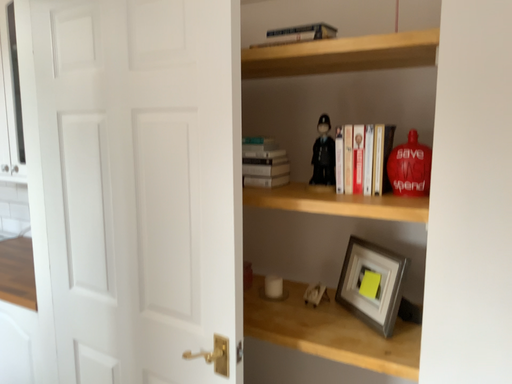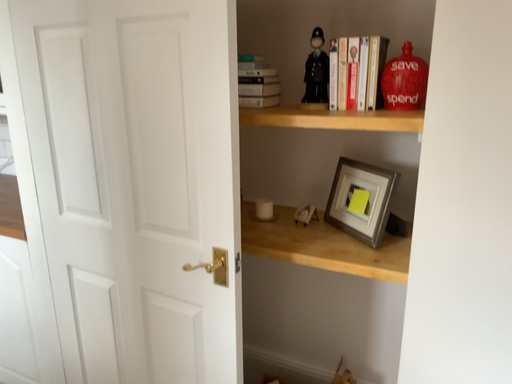
Question: Which way did the camera rotate in the video?

Choices:
 (A) rotated downward
 (B) rotated upward

Answer: (A)